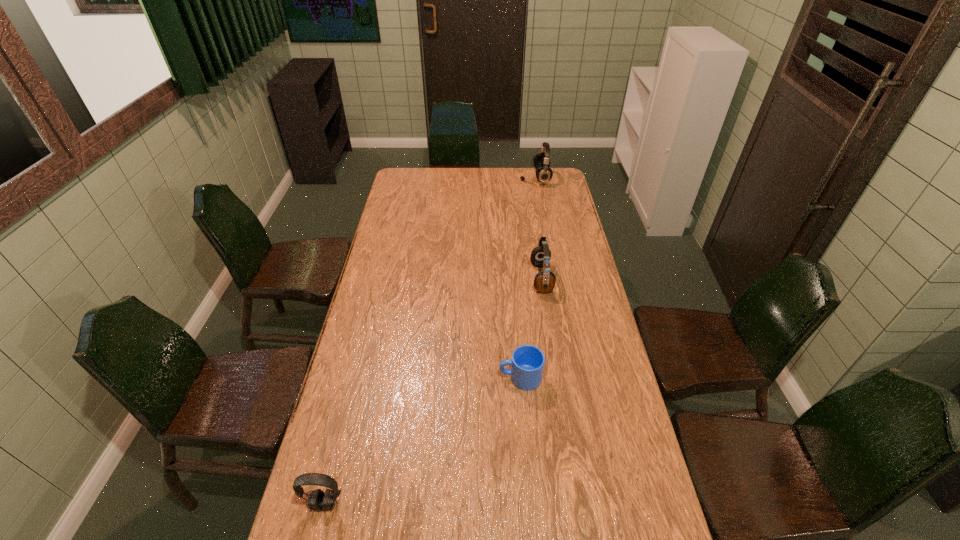
Where is `free region at the right edge of the desktop`? The height and width of the screenshot is (540, 960). free region at the right edge of the desktop is located at coordinates (601, 349).

Find the location of `free spot between the second farthest headset and the leftmost headset`. free spot between the second farthest headset and the leftmost headset is located at coordinates (433, 391).

The image size is (960, 540). In order to click on unoccupied area between the shortest headset and the third farthest object in this screenshot , I will do `click(422, 441)`.

Identify the location of vacant region between the shortest headset and the farthest headset. (430, 341).

The image size is (960, 540). What are the coordinates of `free space between the shortest headset and the mug` in the screenshot? It's located at (422, 441).

This screenshot has width=960, height=540. Identify the location of free space between the second farthest object and the mug. (531, 328).

I want to click on unoccupied area between the farthest object and the shortest headset, so click(x=430, y=341).

Where is `object that stands as the closest to the farthest object`? The image size is (960, 540). object that stands as the closest to the farthest object is located at coordinates (544, 281).

Locate an element on the screen. The width and height of the screenshot is (960, 540). the second closest object to the second farthest headset is located at coordinates (544, 173).

Select which headset is the second closest to the farthest headset. Please provide its 2D coordinates. Your answer should be formatted as a tuple, i.e. [(x, y)], where the tuple contains the x and y coordinates of a point satisfying the conditions above.

[(318, 500)]